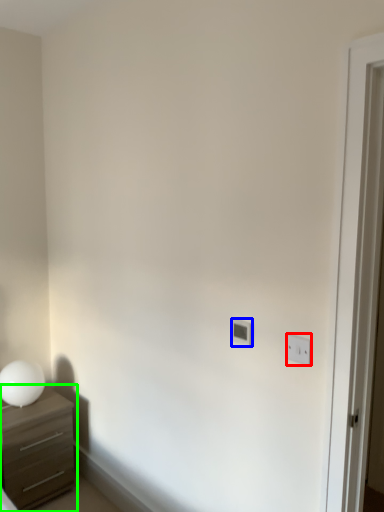
Question: Based on their relative distances, which object is farther from light switch (highlighted by a red box)? Choose from light switch (highlighted by a blue box) and chest of drawers (highlighted by a green box).

Choices:
 (A) light switch
 (B) chest of drawers

Answer: (B)